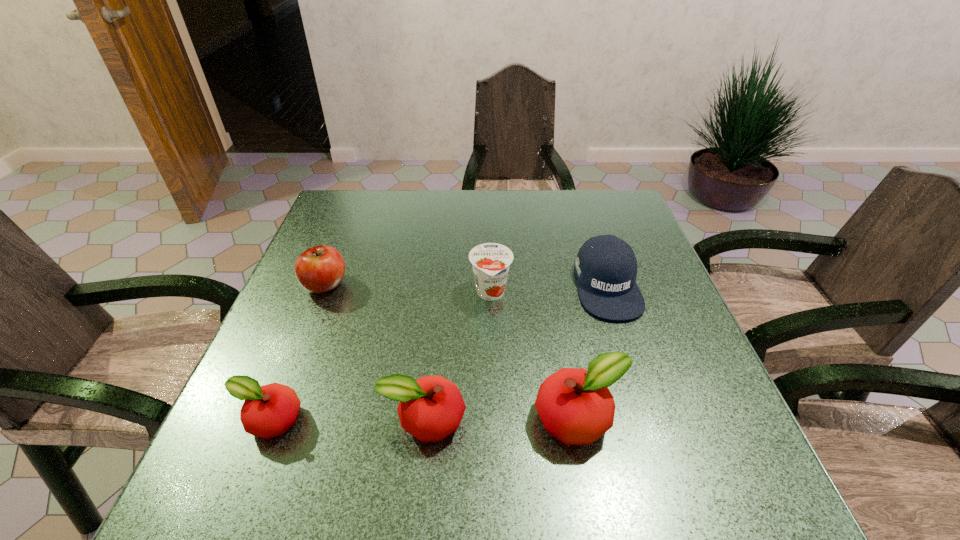
Where is `free location located 0.110m on the front of the farthest apple`? This screenshot has width=960, height=540. free location located 0.110m on the front of the farthest apple is located at coordinates (305, 336).

The height and width of the screenshot is (540, 960). I want to click on vacant region located 0.130m on the front-facing side of the baseball cap, so click(x=635, y=370).

The height and width of the screenshot is (540, 960). I want to click on object that is positioned at the right edge, so click(x=606, y=266).

This screenshot has height=540, width=960. Find the location of `object at the near left corner`. object at the near left corner is located at coordinates (268, 411).

Where is `free space at the far edge of the desktop`? free space at the far edge of the desktop is located at coordinates (483, 208).

Where is `blank space at the near edge of the desktop`? blank space at the near edge of the desktop is located at coordinates coord(525,422).

Where is `free region at the left edge of the desktop`? free region at the left edge of the desktop is located at coordinates (358, 244).

You are a GUI agent. You are given a task and a screenshot of the screen. Output one action in this format:
    pyautogui.click(x=<x>, y=<y>)
    Task: Click on the free spot at the right edge of the desktop
    The image size is (960, 540).
    Given the screenshot: What is the action you would take?
    pyautogui.click(x=701, y=381)

Image resolution: width=960 pixels, height=540 pixels. In order to click on vacant space at the far left corner of the desktop in this screenshot , I will do `click(333, 208)`.

The width and height of the screenshot is (960, 540). In the image, there is a desktop. In order to click on vacant space at the far right corner in this screenshot , I will do `click(614, 192)`.